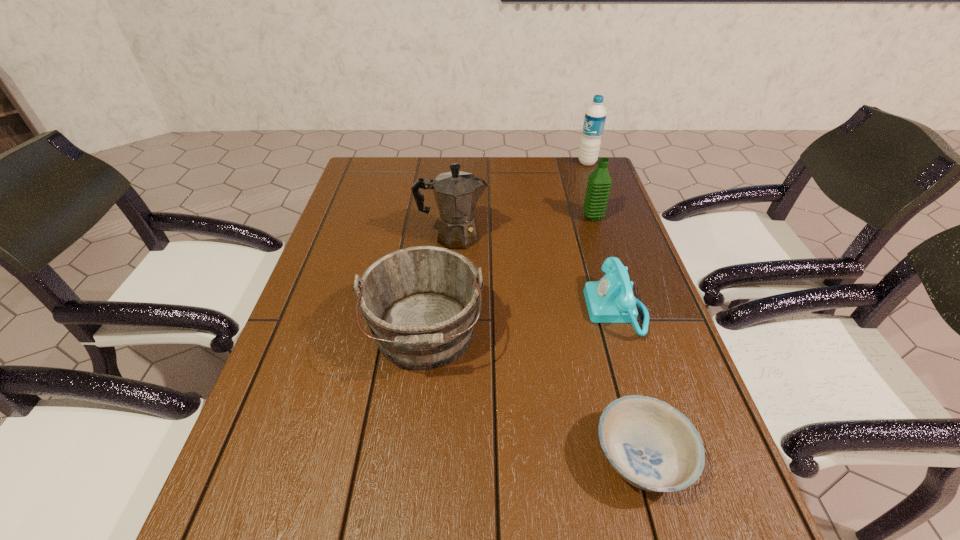
Locate an element on the screen. the taller water bottle is located at coordinates (595, 115).

I want to click on the farther water bottle, so click(x=595, y=115).

I want to click on coffeepot, so click(456, 193).

Identify the location of the nearer water bottle. (599, 182).

Identify the location of the shorter water bottle. This screenshot has height=540, width=960. (599, 182).

Where is `wine bucket`? This screenshot has height=540, width=960. wine bucket is located at coordinates (420, 303).

Find the location of `the second shortest object`. the second shortest object is located at coordinates click(610, 300).

Locate an element on the screen. The height and width of the screenshot is (540, 960). bowl is located at coordinates (651, 445).

Where is `the shortest object`? the shortest object is located at coordinates (651, 445).

Locate an element on the screen. Image resolution: width=960 pixels, height=540 pixels. vacant point located on the label of the taller water bottle is located at coordinates (549, 163).